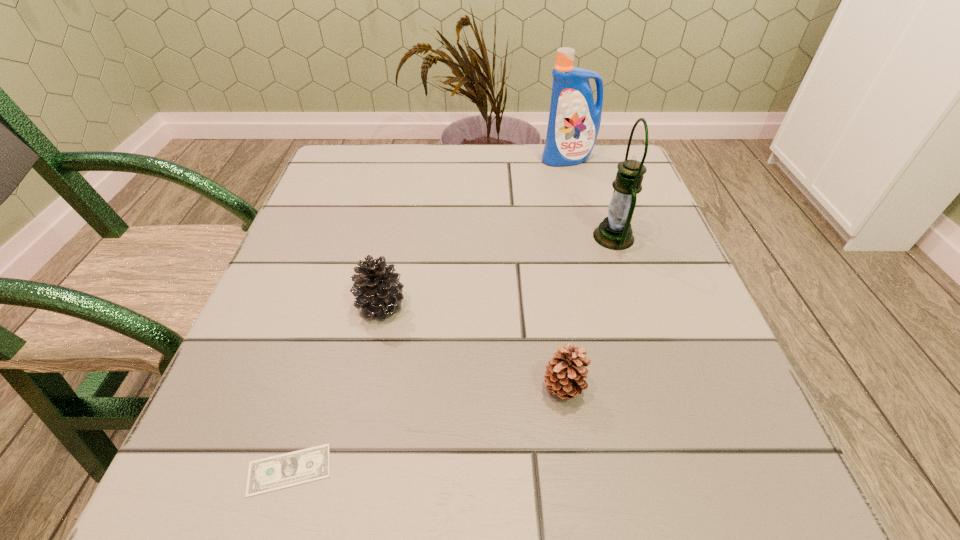
This screenshot has height=540, width=960. Find the location of `object that is the closest to the third shortest object`. object that is the closest to the third shortest object is located at coordinates (273, 473).

Select which object is the third closest to the fourth farthest object. Please provide its 2D coordinates. Your answer should be formatted as a tuple, i.e. [(x, y)], where the tuple contains the x and y coordinates of a point satisfying the conditions above.

[(273, 473)]

Image resolution: width=960 pixels, height=540 pixels. Identify the location of vacant space that satisfies the following two spatial constraints: 1. on the side where the lantern emits light; 2. on the front side of the third farthest object. (636, 306).

Where is `free space in the image that satisfies the following two spatial constraints: 1. on the side where the lantern emits light; 2. on the front side of the money`? The height and width of the screenshot is (540, 960). free space in the image that satisfies the following two spatial constraints: 1. on the side where the lantern emits light; 2. on the front side of the money is located at coordinates (691, 470).

This screenshot has height=540, width=960. Find the location of `blank area in the image that satisfies the following two spatial constraints: 1. on the back side of the money; 2. on the left side of the farther pinecone`. blank area in the image that satisfies the following two spatial constraints: 1. on the back side of the money; 2. on the left side of the farther pinecone is located at coordinates (339, 306).